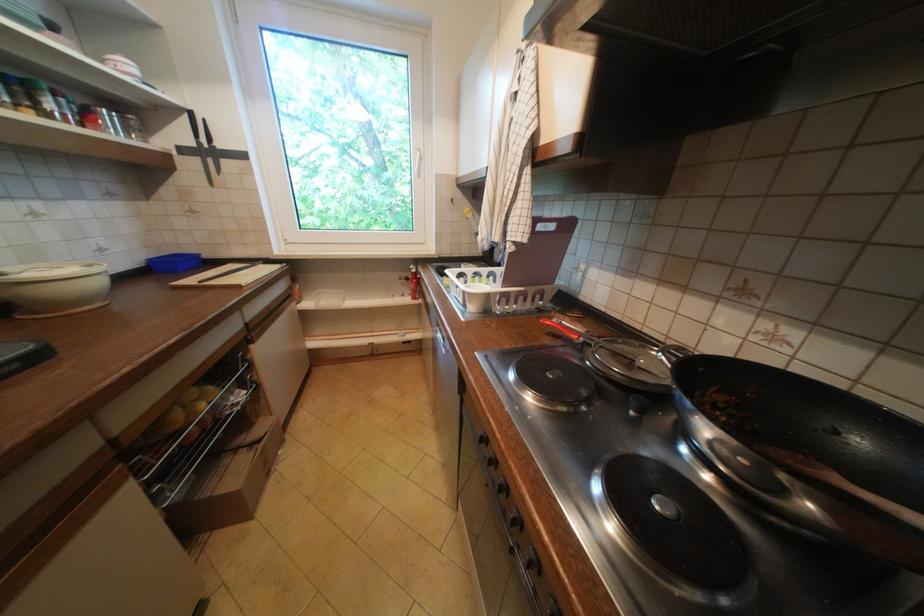
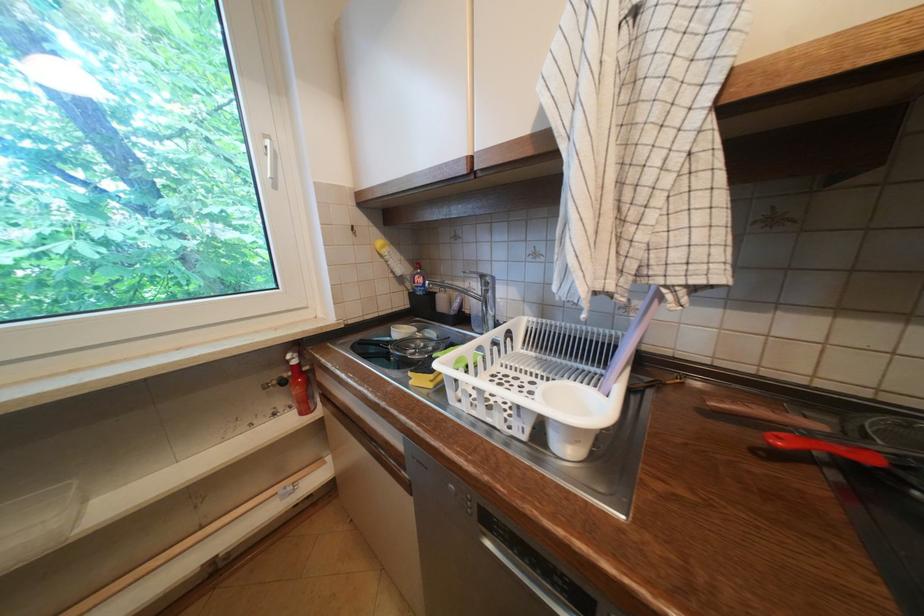
Where in the second image is the point corresponding to point 478,302 from the first image?

(586, 443)